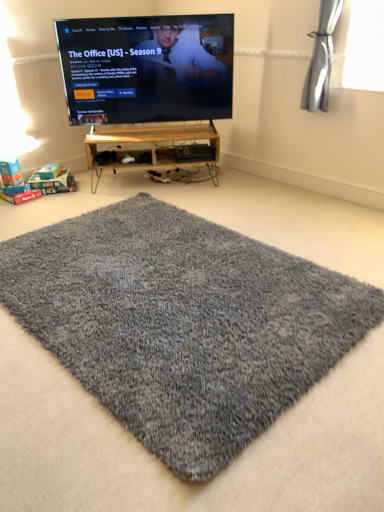
Question: Would you say matte black tv at upper center is outside gray shaggy rug at center?

Choices:
 (A) yes
 (B) no

Answer: (A)

Question: Considering the relative sizes of matte black tv at upper center and gray shaggy rug at center in the image provided, is matte black tv at upper center shorter than gray shaggy rug at center?

Choices:
 (A) no
 (B) yes

Answer: (A)

Question: From a real-world perspective, is matte black tv at upper center on gray shaggy rug at center?

Choices:
 (A) no
 (B) yes

Answer: (B)

Question: Does matte black tv at upper center have a greater height compared to gray shaggy rug at center?

Choices:
 (A) yes
 (B) no

Answer: (A)

Question: Considering the relative sizes of matte black tv at upper center and gray shaggy rug at center in the image provided, is matte black tv at upper center smaller than gray shaggy rug at center?

Choices:
 (A) no
 (B) yes

Answer: (A)

Question: Is matte black tv at upper center positioned far away from gray shaggy rug at center?

Choices:
 (A) yes
 (B) no

Answer: (A)

Question: Is matte black tv at upper center facing towards wooden shelf at center?

Choices:
 (A) no
 (B) yes

Answer: (A)

Question: From the image's perspective, is matte black tv at upper center below wooden shelf at center?

Choices:
 (A) yes
 (B) no

Answer: (B)

Question: From a real-world perspective, does matte black tv at upper center sit lower than wooden shelf at center?

Choices:
 (A) no
 (B) yes

Answer: (A)

Question: Would you say matte black tv at upper center is outside wooden shelf at center?

Choices:
 (A) no
 (B) yes

Answer: (B)

Question: Can you confirm if matte black tv at upper center is smaller than wooden shelf at center?

Choices:
 (A) no
 (B) yes

Answer: (A)

Question: Considering the relative sizes of matte black tv at upper center and wooden shelf at center in the image provided, is matte black tv at upper center thinner than wooden shelf at center?

Choices:
 (A) no
 (B) yes

Answer: (B)

Question: Is wooden shelf at center located outside gray shaggy rug at center?

Choices:
 (A) no
 (B) yes

Answer: (B)